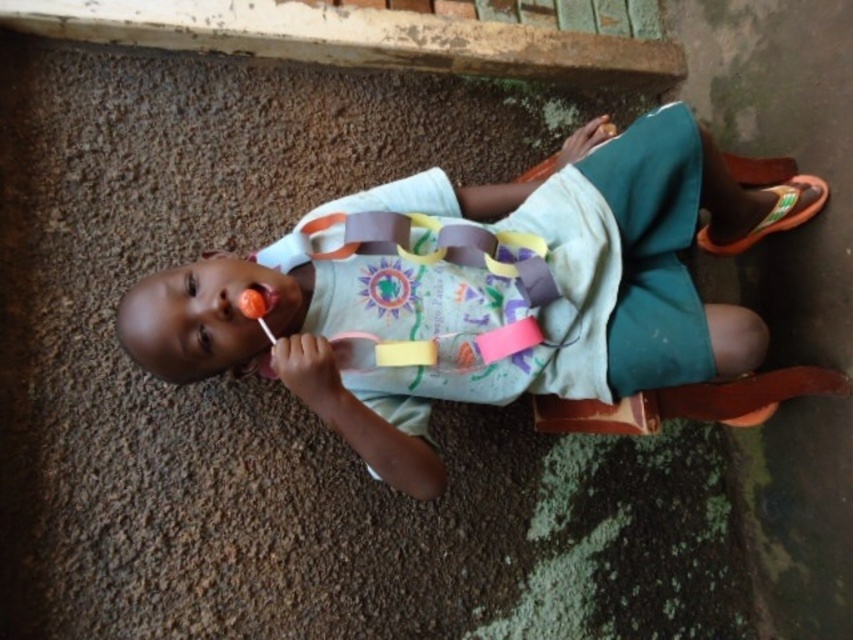
Identify the location of yellow paper strap at center. The height and width of the screenshot is (640, 853). [434, 246].

How distant is yellow paper strap at center from orange fabric sandal at right?

yellow paper strap at center and orange fabric sandal at right are 22.96 inches apart.

Does point (370, 225) lie in front of point (770, 209)?

Yes, point (370, 225) is closer to viewer.

Find the location of a particular element. The height and width of the screenshot is (640, 853). yellow paper strap at center is located at coordinates (434, 246).

How distant is matte plastic lollipop at center from yellow paper strap at center?

matte plastic lollipop at center is 4.06 inches from yellow paper strap at center.

Describe the element at coordinates (474, 292) in the screenshot. This screenshot has width=853, height=640. I see `matte plastic lollipop at center` at that location.

Between point (576, 346) and point (373, 218), which one is positioned behind?

The point (576, 346) is behind.

The width and height of the screenshot is (853, 640). What are the coordinates of `matte plastic lollipop at center` in the screenshot? It's located at (474, 292).

Is matte plastic lollipop at center taller than orange fabric sandal at right?

Yes, matte plastic lollipop at center is taller than orange fabric sandal at right.

Based on the photo, is matte plastic lollipop at center smaller than orange fabric sandal at right?

No.

Is point (393, 428) positioned after point (822, 188)?

No, (393, 428) is in front of (822, 188).

Identify the location of matte plastic lollipop at center. (474, 292).